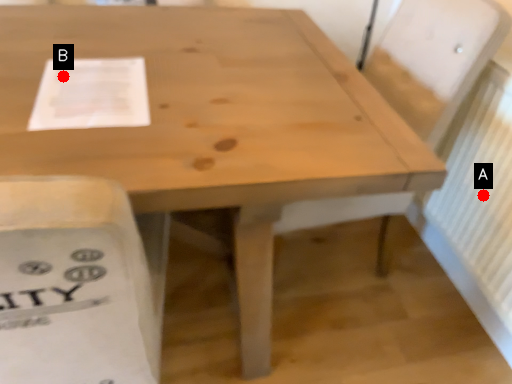
Question: Two points are circled on the image, labeled by A and B beside each circle. Which point appears farthest from the camera in this image?

Choices:
 (A) A is further
 (B) B is further

Answer: (A)